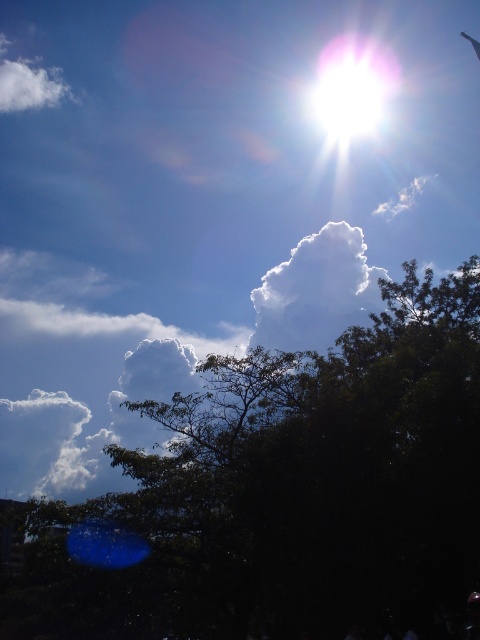
Question: Can you confirm if white fluffy cloud at upper center is bigger than white bright at upper center?

Choices:
 (A) yes
 (B) no

Answer: (A)

Question: Is white fluffy cloud at upper center above white bright at upper center?

Choices:
 (A) yes
 (B) no

Answer: (B)

Question: In this image, where is white fluffy cloud at upper center located relative to white bright at upper center?

Choices:
 (A) above
 (B) below

Answer: (B)

Question: Which of the following is the farthest from the observer?

Choices:
 (A) (342, 467)
 (B) (253, 289)
 (C) (328, 88)

Answer: (C)

Question: Which object is closer to the camera taking this photo?

Choices:
 (A) white fluffy cloud at upper center
 (B) white bright at upper center

Answer: (A)

Question: Which point is farther to the camera?

Choices:
 (A) (356, 100)
 (B) (470, 468)

Answer: (A)